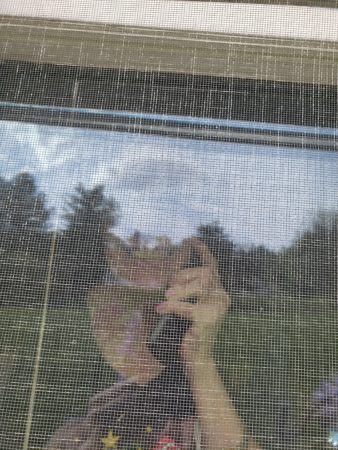
I want to click on screen, so click(x=322, y=356).